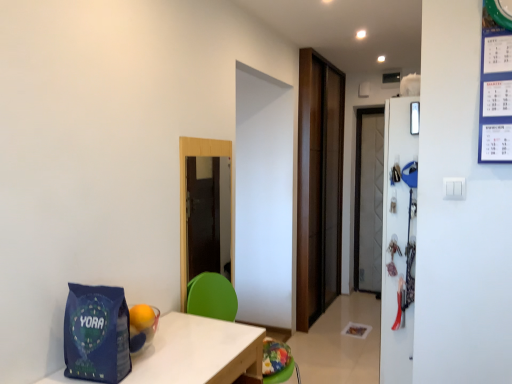
Find the location of a particular element. This screenshot has height=384, width=512. vacant space situated above white wood table at lower left (from a real-world perspective) is located at coordinates (174, 352).